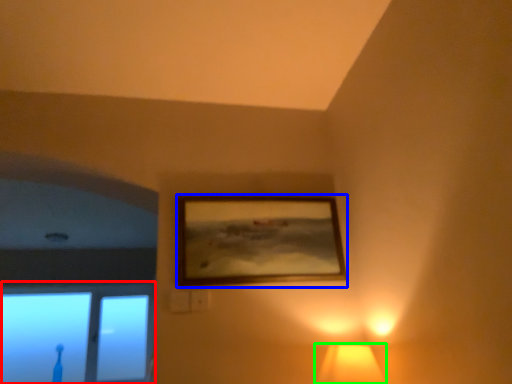
Question: Estimate the real-world distances between objects in this image. Which object is farther from window (highlighted by a red box), picture frame (highlighted by a blue box) or lamp (highlighted by a green box)?

Choices:
 (A) picture frame
 (B) lamp

Answer: (B)